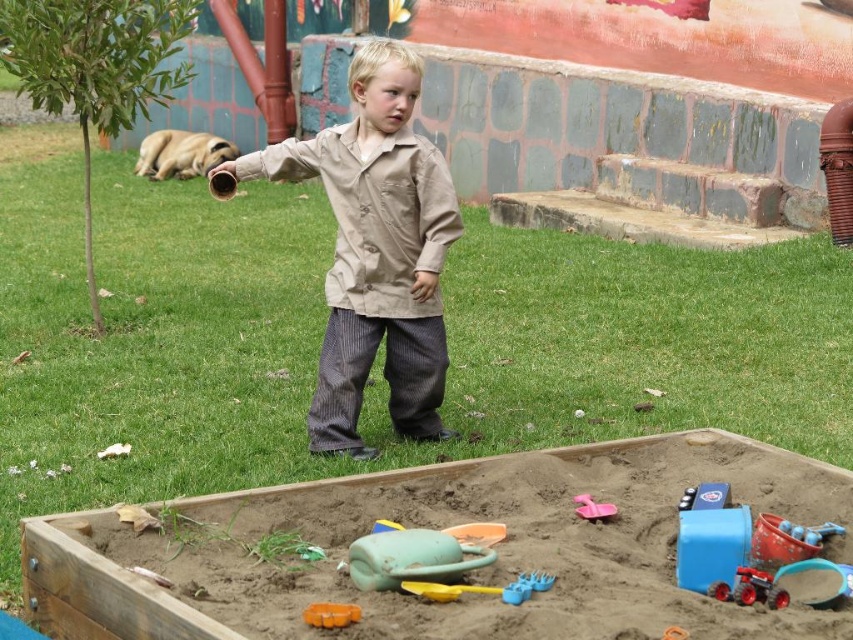
Can you confirm if tan fabric trench coat at center is shorter than orange rubber toy at lower center?

No.

Is point (412, 136) closer to camera compared to point (328, 608)?

No, (412, 136) is further to viewer.

Does point (405, 182) come in front of point (331, 620)?

No, it is not.

Locate an element on the screen. This screenshot has height=640, width=853. tan fabric trench coat at center is located at coordinates (373, 212).

Is brown sandy sandbox at lower center closer to the viewer compared to pink plastic shovel at lower center?

Yes, it is.

Is brown sandy sandbox at lower center above pink plastic shovel at lower center?

No.

The height and width of the screenshot is (640, 853). What are the coordinates of `brown sandy sandbox at lower center` in the screenshot? It's located at (434, 525).

Where is `orange rubber toy at lower center`? orange rubber toy at lower center is located at coordinates (329, 614).

Where is `orange rubber toy at lower center`? The image size is (853, 640). orange rubber toy at lower center is located at coordinates (329, 614).